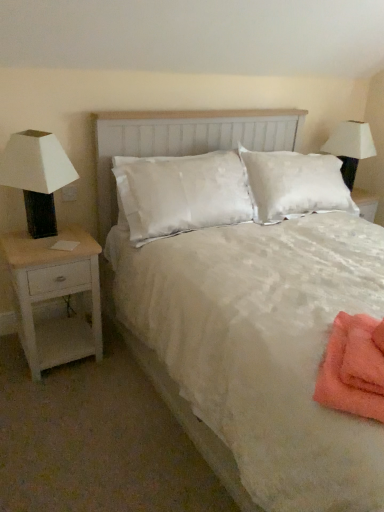
Image resolution: width=384 pixels, height=512 pixels. I want to click on free location in front of white wood nightstand at left, so click(x=55, y=400).